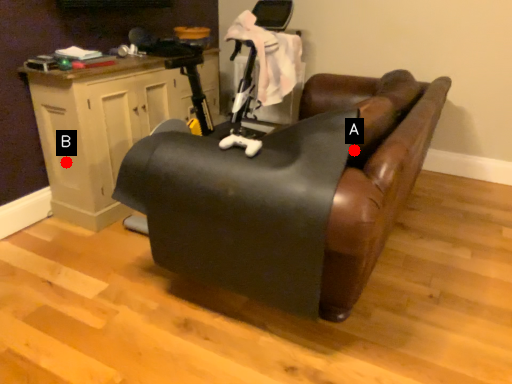
Question: Two points are circled on the image, labeled by A and B beside each circle. Which point appears closest to the camera in this image?

Choices:
 (A) A is closer
 (B) B is closer

Answer: (A)